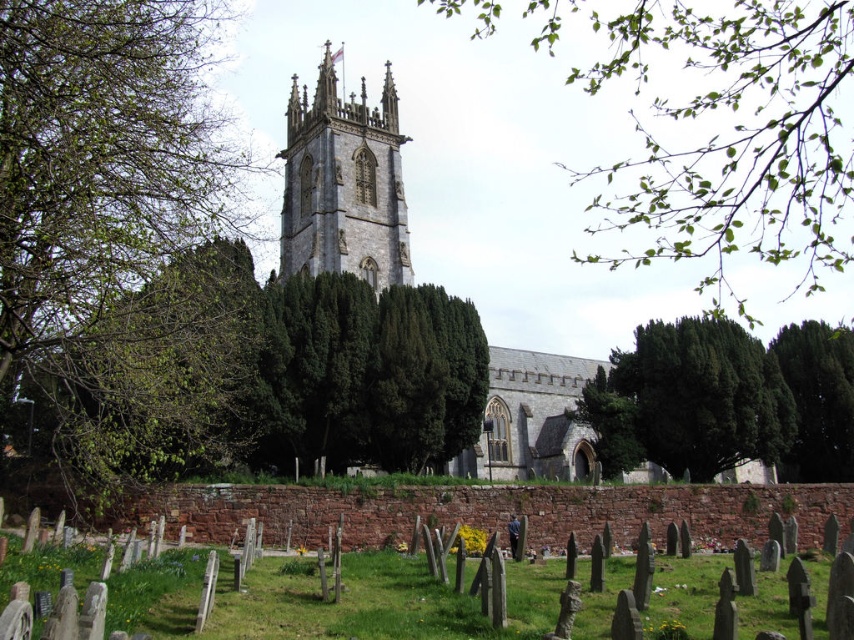
You are standing in the churchyard and notice two green elements in the scene. Which one is closer to you, the green coniferous tree at center or the green leafy branch at upper center?

The green coniferous tree at center is closer to you than the green leafy branch at upper center because it appears smaller in the scene.

You are standing in the churchyard and notice the green coniferous tree at center and the green leafy branch at upper center. Which of these two objects appears narrower?

The green coniferous tree at center appears narrower than the green leafy branch at upper center.

You are standing in the churchyard and want to take a photo of the stone gothic tower at center. There is a green coniferous tree at center blocking part of your view. Which direction should you move to get a clear shot of the tower without the tree obstructing it?

You should move to the right side of the green coniferous tree at center since it is positioned to the left of the stone gothic tower at center, so moving right would allow you to see the tower unobstructed.